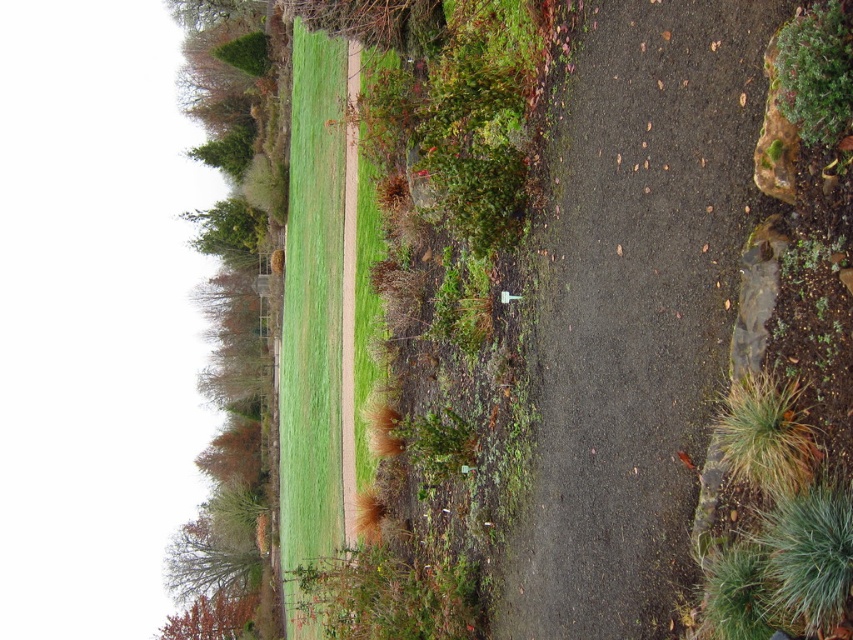
You are standing at the point marked by coordinates point (312, 305) in the image. Based on the scene description, what type of terrain are you currently standing on?

The point (312, 305) corresponds to green grass at center, so you are standing on green grass at center.

You are standing on the paved pathway and want to walk to the grassy area. Which direction should you go to reach the green grass at center before the brown fuzzy grass at lower right?

You should go to the left side because the green grass at center is positioned on the left side of brown fuzzy grass at lower right, so it is closer to your current position on the pathway.

You are a gardener who wants to mow the green grass at center and brown fuzzy grass at lower right. Which area requires a lower mower height setting to avoid damaging the plants?

The brown fuzzy grass at lower right requires a lower mower height setting because it is shorter than the green grass at center.